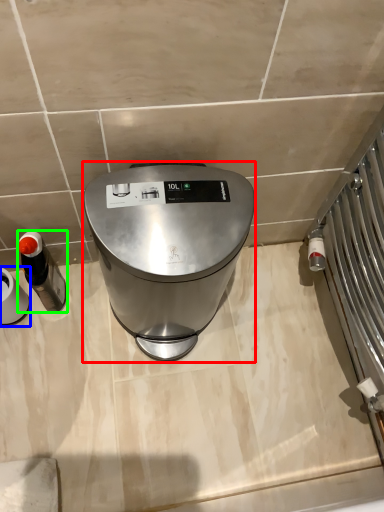
Question: Which object is positioned farthest from home appliance (highlighted by a red box)? Select from appliance (highlighted by a blue box) and appliance (highlighted by a green box).

Choices:
 (A) appliance
 (B) appliance

Answer: (A)